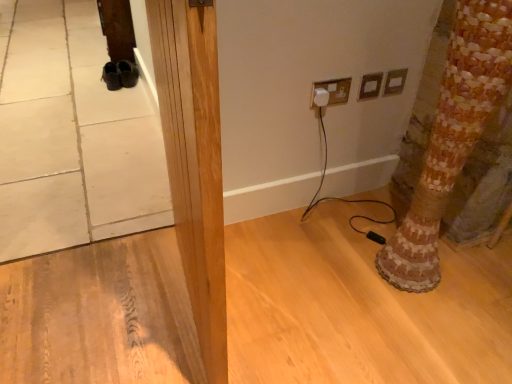
In the scene shown: Measure the distance between natural wood pillar at center and camera.

natural wood pillar at center is 18.81 inches from camera.

Describe the element at coordinates (452, 137) in the screenshot. I see `wooden mosaic tree trunk at lower right` at that location.

This screenshot has width=512, height=384. Describe the element at coordinates (335, 90) in the screenshot. I see `white plastic plug at upper center, the 1th electric outlet from the left` at that location.

Locate an element on the screen. This screenshot has width=512, height=384. white plastic plug at upper center, the 1th electric outlet from the left is located at coordinates (335, 90).

Find the location of `natural wood pillar at center`. natural wood pillar at center is located at coordinates (194, 160).

Is the position of natural wood pillar at center more distant than that of matte plastic electric outlet at upper right, which is the 3th electric outlet from left to right?

No, it is in front of matte plastic electric outlet at upper right, which is the 3th electric outlet from left to right.

Is point (152, 20) positioned after point (399, 69)?

No, it is in front of (399, 69).

Is natural wood pillar at center far away from matte plastic electric outlet at upper right, the first electric outlet viewed from the right?

Yes, natural wood pillar at center is far from matte plastic electric outlet at upper right, the first electric outlet viewed from the right.

Is natural wood pillar at center inside or outside of matte plastic electric outlet at upper right, which is the 3th electric outlet from left to right?

natural wood pillar at center is not inside matte plastic electric outlet at upper right, which is the 3th electric outlet from left to right, it's outside.

Which of these two, matte plastic outlet at upper right, which is the second electric outlet from right to left, or matte plastic electric outlet at upper right, the first electric outlet viewed from the right, is wider?

matte plastic electric outlet at upper right, the first electric outlet viewed from the right, is wider.

Could you tell me if matte plastic outlet at upper right, acting as the 2th electric outlet starting from the left, is facing matte plastic electric outlet at upper right, the first electric outlet viewed from the right?

No, matte plastic outlet at upper right, acting as the 2th electric outlet starting from the left, is not aimed at matte plastic electric outlet at upper right, the first electric outlet viewed from the right.

From a real-world perspective, which object rests below the other?

matte plastic outlet at upper right, acting as the 2th electric outlet starting from the left, from a real-world perspective.

Which is less distant, (367,98) or (391,77)?

The point (391,77) is closer.

Is matte plastic electric outlet at upper right, the first electric outlet viewed from the right, at the right side of wooden mosaic tree trunk at lower right?

No.

From the image's perspective, starting from the wooden mosaic tree trunk at lower right, which electric outlet is the 3rd one above? Please provide its 2D coordinates.

[(395, 82)]

Between matte plastic electric outlet at upper right, which is the 3th electric outlet from left to right, and wooden mosaic tree trunk at lower right, which one has larger size?

wooden mosaic tree trunk at lower right.

Could wooden mosaic tree trunk at lower right be considered to be inside matte plastic electric outlet at upper right, the first electric outlet viewed from the right?

No, wooden mosaic tree trunk at lower right is not surrounded by matte plastic electric outlet at upper right, the first electric outlet viewed from the right.

Based on the photo, who is bigger, white plastic plug at upper center, the 3th electric outlet from the right, or matte plastic electric outlet at upper right, which is the 3th electric outlet from left to right?

With larger size is white plastic plug at upper center, the 3th electric outlet from the right.

Is white plastic plug at upper center, the 1th electric outlet from the left, facing towards matte plastic electric outlet at upper right, the first electric outlet viewed from the right?

No, white plastic plug at upper center, the 1th electric outlet from the left, is not oriented towards matte plastic electric outlet at upper right, the first electric outlet viewed from the right.

Which point is more distant from viewer, (329, 97) or (388, 93)?

The point (388, 93) is farther from the camera.

From a real-world perspective, who is located higher, white plastic plug at upper center, the 1th electric outlet from the left, or matte plastic electric outlet at upper right, the first electric outlet viewed from the right?

white plastic plug at upper center, the 1th electric outlet from the left.

How different are the orientations of white plastic plug at upper center, the 1th electric outlet from the left, and natural wood pillar at center in degrees?

There is a 92.6-degree angle between the facing directions of white plastic plug at upper center, the 1th electric outlet from the left, and natural wood pillar at center.

Where is `the 1st electric outlet positioned above the natural wood pillar at center (from the image's perspective)`? This screenshot has height=384, width=512. the 1st electric outlet positioned above the natural wood pillar at center (from the image's perspective) is located at coordinates (335, 90).

Is white plastic plug at upper center, the 3th electric outlet from the right, positioned behind natural wood pillar at center?

Yes, it is behind natural wood pillar at center.

Considering the sizes of objects white plastic plug at upper center, the 1th electric outlet from the left, and natural wood pillar at center in the image provided, who is wider, white plastic plug at upper center, the 1th electric outlet from the left, or natural wood pillar at center?

With larger width is natural wood pillar at center.

Is matte plastic outlet at upper right, which is the second electric outlet from right to left, next to wooden mosaic tree trunk at lower right and touching it?

No, matte plastic outlet at upper right, which is the second electric outlet from right to left, is not next to wooden mosaic tree trunk at lower right.

Which is farther from the camera, (378,86) or (511,55)?

The point (378,86) is more distant.

Considering the positions of objects matte plastic outlet at upper right, which is the second electric outlet from right to left, and wooden mosaic tree trunk at lower right in the image provided, who is more to the right, matte plastic outlet at upper right, which is the second electric outlet from right to left, or wooden mosaic tree trunk at lower right?

Positioned to the right is wooden mosaic tree trunk at lower right.

From the image's perspective, is wooden mosaic tree trunk at lower right on natural wood pillar at center?

Correct, wooden mosaic tree trunk at lower right appears higher than natural wood pillar at center in the image.

What's the angular difference between wooden mosaic tree trunk at lower right and natural wood pillar at center's facing directions?

They differ by 3.14 degrees in their facing directions.

Are wooden mosaic tree trunk at lower right and natural wood pillar at center far apart?

That's not correct — wooden mosaic tree trunk at lower right is a little close to natural wood pillar at center.

Is wooden mosaic tree trunk at lower right in front of or behind natural wood pillar at center in the image?

Clearly, wooden mosaic tree trunk at lower right is behind natural wood pillar at center.

Identify the location of the 2nd electric outlet below the natural wood pillar at center (from a real-world perspective). (395, 82).

Identify the location of the 1st electric outlet located above the matte plastic outlet at upper right, acting as the 2th electric outlet starting from the left (from a real-world perspective). coord(395,82).

Looking at the image, which one is located further to white plastic plug at upper center, the 3th electric outlet from the right, natural wood pillar at center or wooden mosaic tree trunk at lower right?

natural wood pillar at center is further to white plastic plug at upper center, the 3th electric outlet from the right.

When comparing their distances from white plastic plug at upper center, the 1th electric outlet from the left, does matte plastic outlet at upper right, which is the second electric outlet from right to left, or wooden mosaic tree trunk at lower right seem closer?

matte plastic outlet at upper right, which is the second electric outlet from right to left, lies closer to white plastic plug at upper center, the 1th electric outlet from the left, than the other object.

Consider the image. Which object lies nearer to the anchor point white plastic plug at upper center, the 1th electric outlet from the left, matte plastic electric outlet at upper right, the first electric outlet viewed from the right, or natural wood pillar at center?

The object closer to white plastic plug at upper center, the 1th electric outlet from the left, is matte plastic electric outlet at upper right, the first electric outlet viewed from the right.

Estimate the real-world distances between objects in this image. Which object is closer to white plastic plug at upper center, the 3th electric outlet from the right, matte plastic electric outlet at upper right, the first electric outlet viewed from the right, or matte plastic outlet at upper right, which is the second electric outlet from right to left?

matte plastic outlet at upper right, which is the second electric outlet from right to left, is positioned closer to the anchor white plastic plug at upper center, the 3th electric outlet from the right.

Based on their spatial positions, is wooden mosaic tree trunk at lower right or natural wood pillar at center closer to white plastic plug at upper center, the 3th electric outlet from the right?

Based on the image, wooden mosaic tree trunk at lower right appears to be nearer to white plastic plug at upper center, the 3th electric outlet from the right.

When comparing their distances from wooden mosaic tree trunk at lower right, does white plastic plug at upper center, the 1th electric outlet from the left, or matte plastic electric outlet at upper right, which is the 3th electric outlet from left to right, seem further?

Based on the image, matte plastic electric outlet at upper right, which is the 3th electric outlet from left to right, appears to be further to wooden mosaic tree trunk at lower right.

Looking at the image, which one is located further to matte plastic electric outlet at upper right, which is the 3th electric outlet from left to right, matte plastic outlet at upper right, acting as the 2th electric outlet starting from the left, or white plastic plug at upper center, the 1th electric outlet from the left?

white plastic plug at upper center, the 1th electric outlet from the left, lies further to matte plastic electric outlet at upper right, which is the 3th electric outlet from left to right, than the other object.

When comparing their distances from matte plastic outlet at upper right, acting as the 2th electric outlet starting from the left, does white plastic plug at upper center, the 3th electric outlet from the right, or matte plastic electric outlet at upper right, which is the 3th electric outlet from left to right, seem further?

white plastic plug at upper center, the 3th electric outlet from the right.

The width and height of the screenshot is (512, 384). What are the coordinates of `tree trunk between natural wood pillar at center and matte plastic outlet at upper right, acting as the 2th electric outlet starting from the left, in the front-back direction` in the screenshot? It's located at (452, 137).

In order to click on tree trunk positioned between natural wood pillar at center and white plastic plug at upper center, the 1th electric outlet from the left, from near to far in this screenshot , I will do `click(452, 137)`.

Where is `electric outlet located between wooden mosaic tree trunk at lower right and matte plastic outlet at upper right, acting as the 2th electric outlet starting from the left, in the depth direction`? This screenshot has height=384, width=512. electric outlet located between wooden mosaic tree trunk at lower right and matte plastic outlet at upper right, acting as the 2th electric outlet starting from the left, in the depth direction is located at coordinates (335, 90).

The image size is (512, 384). I want to click on electric outlet between natural wood pillar at center and matte plastic outlet at upper right, which is the second electric outlet from right to left, along the z-axis, so click(335, 90).